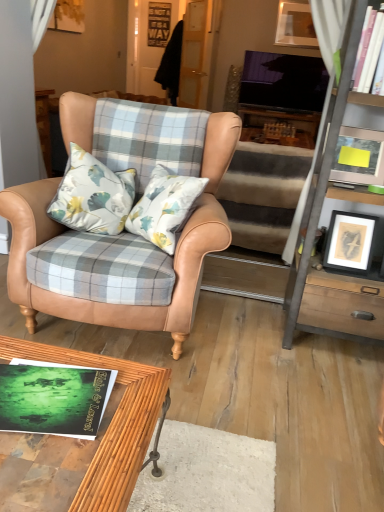
Question: Can you confirm if matte wooden picture frame at upper right, which is the third picture frame in front-to-back order, is wider than bamboo wood coffee table at lower center?

Choices:
 (A) yes
 (B) no

Answer: (B)

Question: Can you confirm if matte wooden picture frame at upper right, the third picture frame when ordered from left to right, is taller than bamboo wood coffee table at lower center?

Choices:
 (A) yes
 (B) no

Answer: (A)

Question: From the image's perspective, does matte wooden picture frame at upper right, the 3th picture frame in the bottom-to-top sequence, appear lower than bamboo wood coffee table at lower center?

Choices:
 (A) yes
 (B) no

Answer: (B)

Question: From a real-world perspective, is matte wooden picture frame at upper right, acting as the 1th picture frame starting from the right, located beneath bamboo wood coffee table at lower center?

Choices:
 (A) no
 (B) yes

Answer: (A)

Question: Is matte wooden picture frame at upper right, the third picture frame when ordered from left to right, turned away from bamboo wood coffee table at lower center?

Choices:
 (A) yes
 (B) no

Answer: (B)

Question: Is matte wooden picture frame at upper right, which is counted as the 1th picture frame, starting from the back, in front of bamboo wood coffee table at lower center?

Choices:
 (A) yes
 (B) no

Answer: (B)

Question: Is green matte book at lower left beside metallic gray cabinet at right?

Choices:
 (A) no
 (B) yes

Answer: (A)

Question: Considering the relative positions of green matte book at lower left and metallic gray cabinet at right in the image provided, is green matte book at lower left in front of metallic gray cabinet at right?

Choices:
 (A) yes
 (B) no

Answer: (A)

Question: Can you confirm if green matte book at lower left is taller than metallic gray cabinet at right?

Choices:
 (A) yes
 (B) no

Answer: (B)

Question: Is green matte book at lower left at the left side of metallic gray cabinet at right?

Choices:
 (A) yes
 (B) no

Answer: (A)

Question: Can you confirm if green matte book at lower left is smaller than metallic gray cabinet at right?

Choices:
 (A) no
 (B) yes

Answer: (B)

Question: From the image's perspective, does green matte book at lower left appear lower than metallic gray cabinet at right?

Choices:
 (A) no
 (B) yes

Answer: (B)

Question: From a real-world perspective, is bamboo wood coffee table at lower center physically below metallic gray cabinet at right?

Choices:
 (A) no
 (B) yes

Answer: (B)